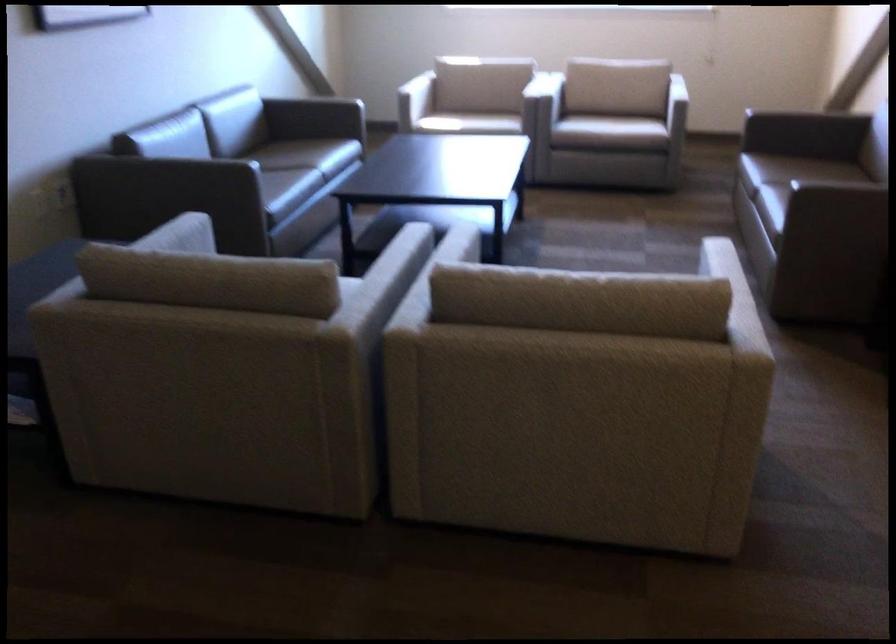
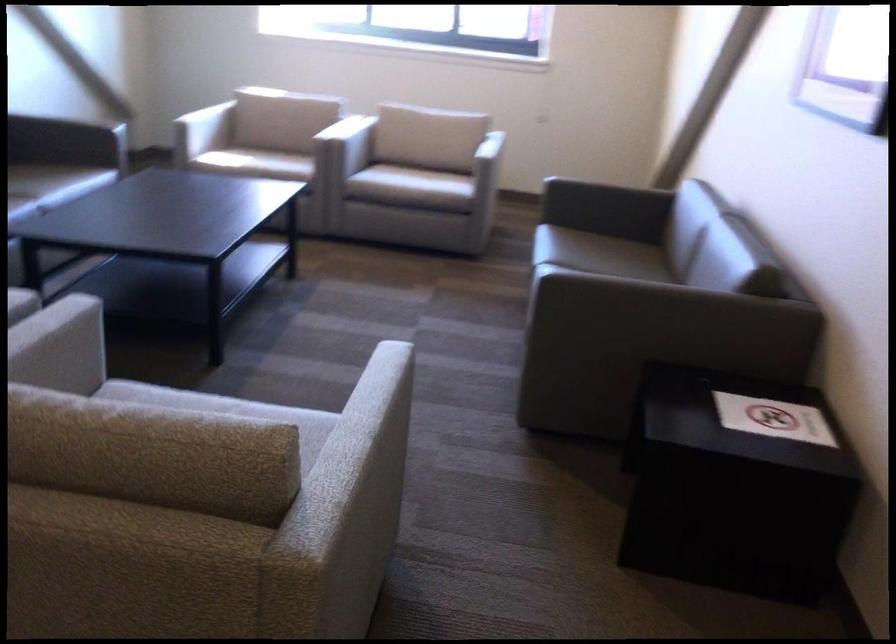
The point at [615,386] is marked in the first image. Where is the corresponding point in the second image?

(115, 596)